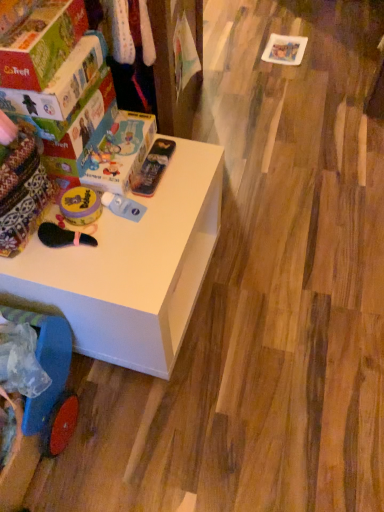
You are a GUI agent. You are given a task and a screenshot of the screen. Output one action in this format:
    pyautogui.click(x=<x>, y=<y>)
    Task: Click on the vacant space to the right of yellow matte bubble container at center, which is the 2th toy in right-to-left order
    This screenshot has height=512, width=384.
    Given the screenshot: What is the action you would take?
    pyautogui.click(x=180, y=202)